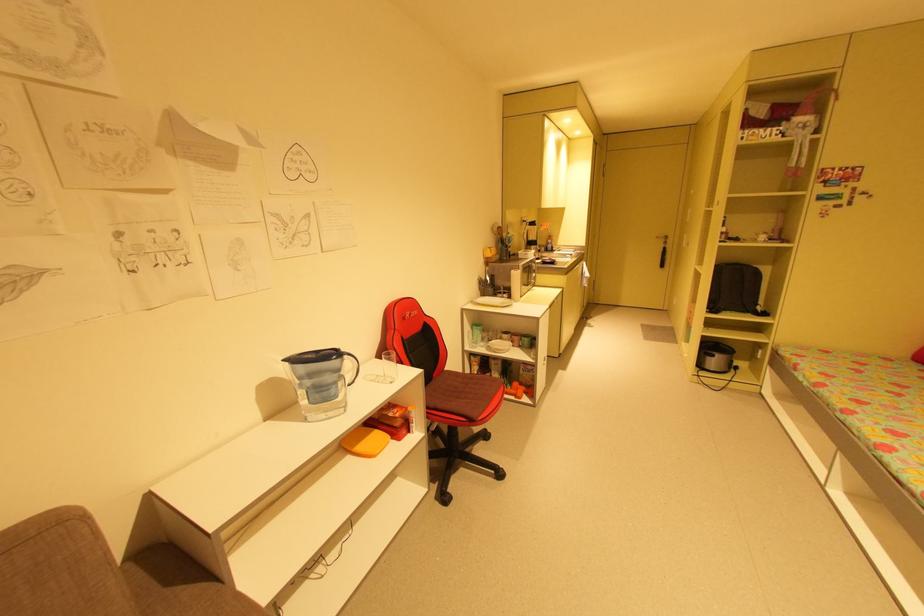
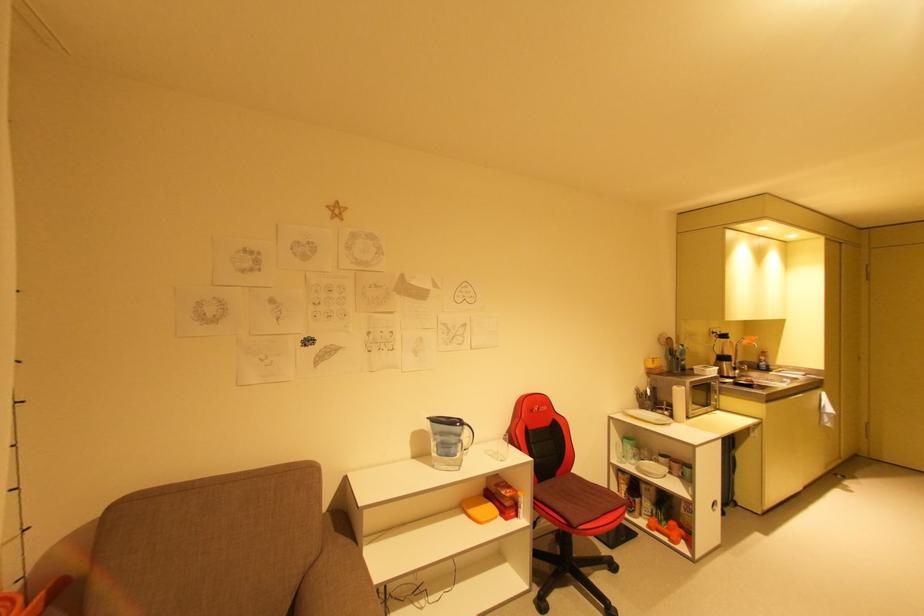
The point at (287, 361) is marked in the first image. Where is the corresponding point in the second image?

(432, 418)